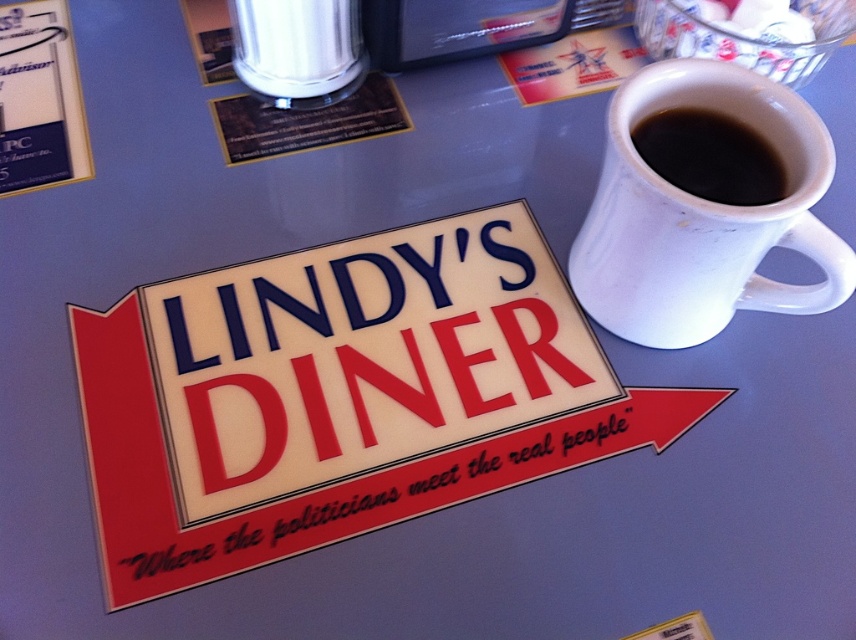
Question: Can you confirm if white matte mug at upper right is bigger than black matte mug at upper right?

Choices:
 (A) yes
 (B) no

Answer: (A)

Question: Among these objects, which one is nearest to the camera?

Choices:
 (A) white matte mug at upper right
 (B) black matte mug at upper right

Answer: (A)

Question: From the image, what is the correct spatial relationship of white matte mug at upper right in relation to black matte mug at upper right?

Choices:
 (A) above
 (B) below

Answer: (B)

Question: Which point appears closest to the camera in this image?

Choices:
 (A) (721, 84)
 (B) (717, 182)

Answer: (B)

Question: Does white matte mug at upper right have a lesser width compared to black matte mug at upper right?

Choices:
 (A) yes
 (B) no

Answer: (B)